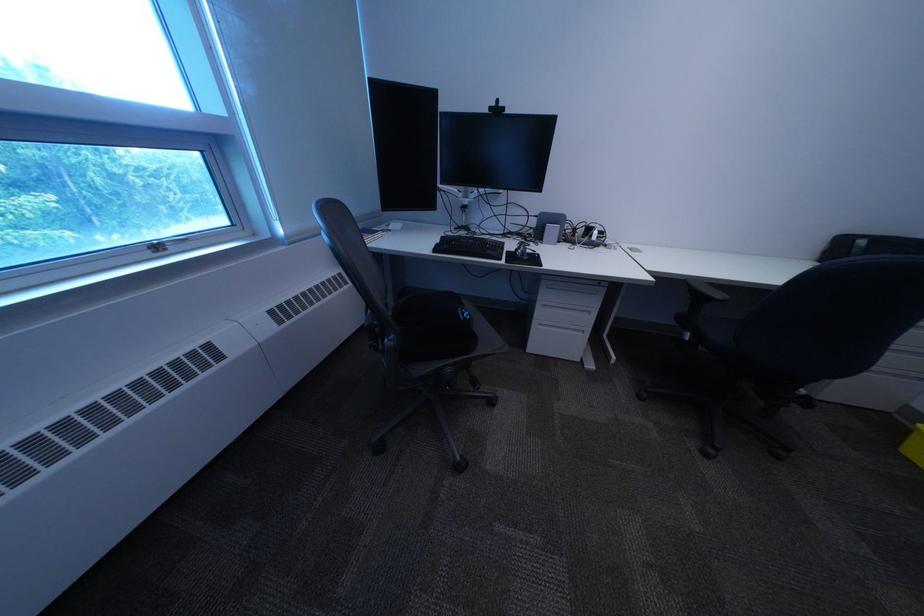
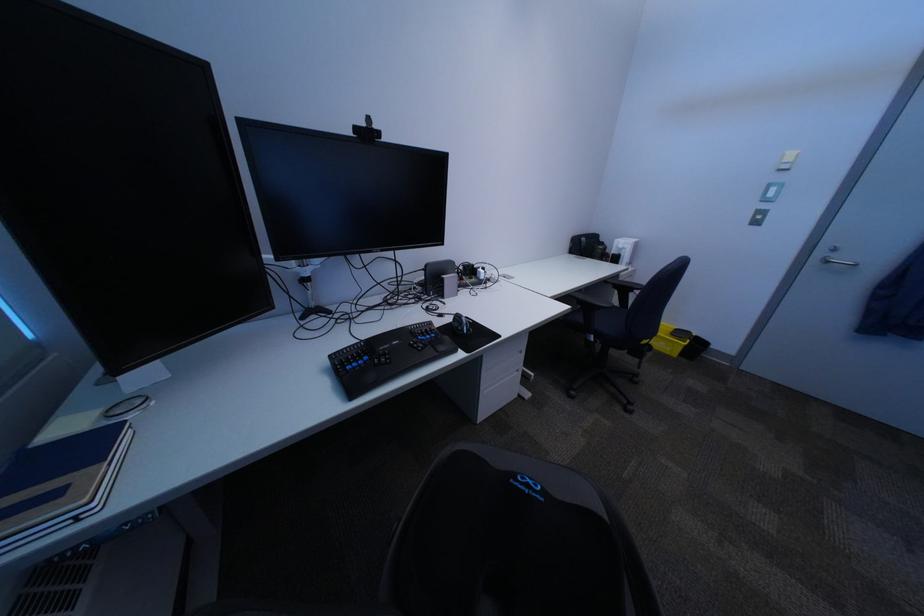
In the second image, find the point that corresponds to pixel 505 110 in the first image.

(371, 131)